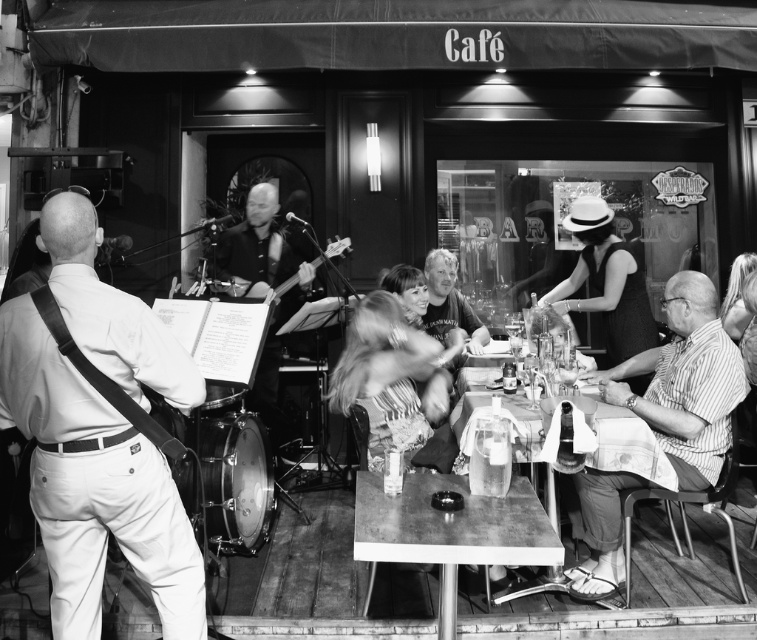
Question: Can you confirm if wooden table at center is positioned to the left of clear plastic cup at center?

Choices:
 (A) no
 (B) yes

Answer: (A)

Question: Does metallic polished table at center come in front of wooden acoustic guitar at center?

Choices:
 (A) no
 (B) yes

Answer: (B)

Question: Is wooden table at center to the left of clear plastic cup at center from the viewer's perspective?

Choices:
 (A) yes
 (B) no

Answer: (B)

Question: Which of the following is the closest to the observer?

Choices:
 (A) (500, 436)
 (B) (667, 444)
 (C) (291, 282)

Answer: (A)

Question: Which object appears closest to the camera in this image?

Choices:
 (A) wooden table at center
 (B) striped cotton shirt at right
 (C) metallic polished table at center

Answer: (C)

Question: Which object is positioned closest to the wooden acoustic guitar at center?

Choices:
 (A) clear plastic cup at center
 (B) wooden table at center

Answer: (B)